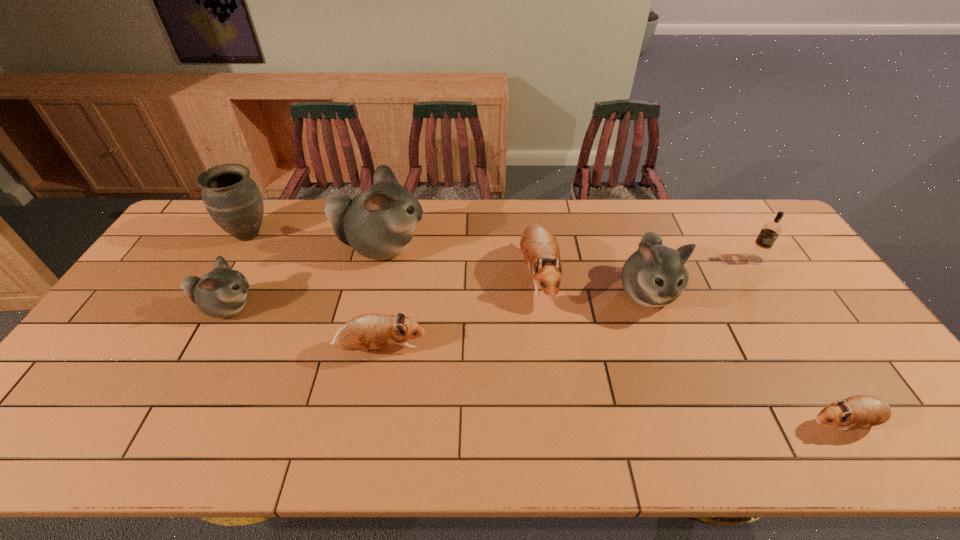
This screenshot has width=960, height=540. I want to click on the second nearest hamster, so (x=365, y=332).

Where is `the seventh tallest object`? The image size is (960, 540). the seventh tallest object is located at coordinates (365, 332).

Where is `the shortest object`? This screenshot has height=540, width=960. the shortest object is located at coordinates (862, 410).

Locate an element on the screen. Image resolution: width=960 pixels, height=540 pixels. the nearest brown hamster is located at coordinates (862, 410).

Locate an element on the screen. vacant space situated 0.400m on the face of the tallest hamster is located at coordinates (548, 247).

The height and width of the screenshot is (540, 960). In order to click on free space located on the back of the urn in this screenshot , I will do `click(268, 202)`.

Where is `free space located on the face of the sixth object from left to right`? The width and height of the screenshot is (960, 540). free space located on the face of the sixth object from left to right is located at coordinates (675, 370).

Locate an element on the screen. free spot located 0.090m on the label of the vodka is located at coordinates (772, 286).

The image size is (960, 540). I want to click on vacant space located on the face of the leftmost hamster, so click(319, 308).

The width and height of the screenshot is (960, 540). I want to click on vacant space positioned at the face of the fourth object from right to left, so click(546, 341).